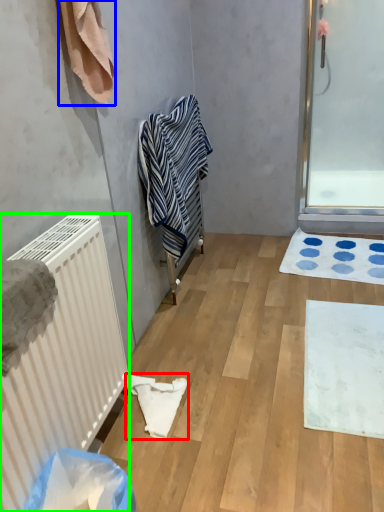
Question: Which object is the closest to the material (highlighted by a red box)? Choose among these: towel (highlighted by a blue box) or radiator (highlighted by a green box).

Choices:
 (A) towel
 (B) radiator

Answer: (B)